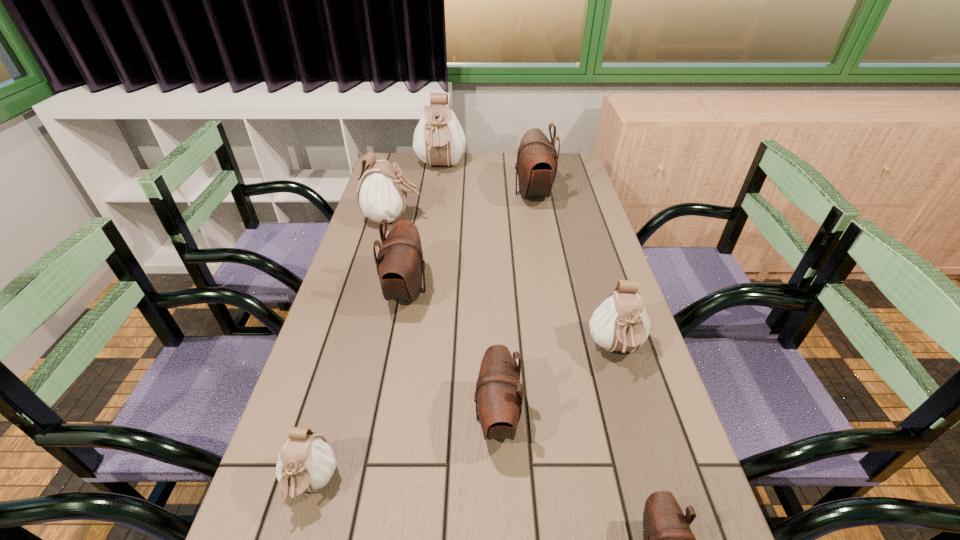
Find the location of a particular element. The height and width of the screenshot is (540, 960). the farthest white pouch is located at coordinates (438, 139).

You are a GUI agent. You are given a task and a screenshot of the screen. Output one action in this format:
    pyautogui.click(x=<x>, y=<y>)
    Task: Click on the farthest brown pouch
    
    Given the screenshot: What is the action you would take?
    pyautogui.click(x=537, y=160)

The width and height of the screenshot is (960, 540). In order to click on the second biggest white pouch in this screenshot , I will do `click(382, 193)`.

At what (x,y) coordinates should I click in order to perform the action: click on the second biggest brown pouch. Please return your answer as a coordinate pair (x, y). Looking at the image, I should click on (400, 264).

This screenshot has height=540, width=960. What are the coordinates of `the fifth nearest object` in the screenshot? It's located at (400, 264).

You are a GUI agent. You are given a task and a screenshot of the screen. Output one action in this format:
    pyautogui.click(x=<x>, y=<y>)
    Task: Click on the second nearest white pouch
    Image resolution: width=960 pixels, height=540 pixels.
    Given the screenshot: What is the action you would take?
    pyautogui.click(x=620, y=323)

This screenshot has width=960, height=540. Find the location of `the fourth nearest pouch`. the fourth nearest pouch is located at coordinates tap(620, 323).

The width and height of the screenshot is (960, 540). Identify the location of the third brown pouch from right to left. (499, 393).

Identify the location of the second nearest brown pouch. The image size is (960, 540). (499, 393).

You are a GUI agent. You are given a task and a screenshot of the screen. Output one action in this format:
    pyautogui.click(x=<x>, y=<y>)
    Task: Click on the nearest white pouch
    This screenshot has width=960, height=540.
    Given the screenshot: What is the action you would take?
    pyautogui.click(x=306, y=462)